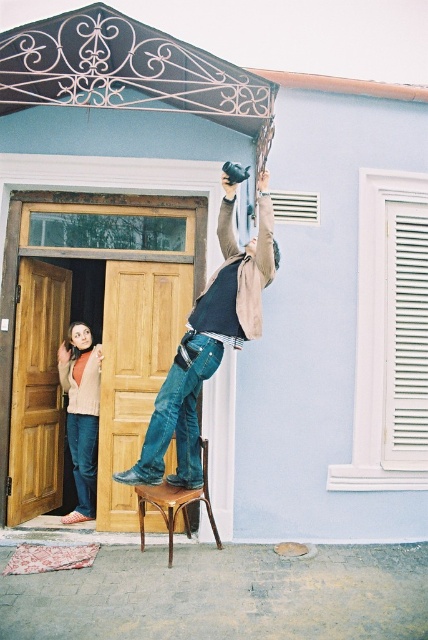
You are a photographer trying to set up a camera on a tripod. You have a denim jeans at left and a brown wooden chair at center in your view. Which object can you use to reach a higher position to adjust the camera?

The denim jeans at left is much taller than the brown wooden chair at center, so you can use the denim jeans at left to reach a higher position to adjust the camera.

You are a delivery person trying to deliver a package to the building with a light blue facade. The recipient is standing at the point marked by the coordinates point (208, 342). Where should you approach to find them?

The point (208, 342) marks denim jeans at center, so you should approach the center area where the denim jeans are located to find the recipient.

You are a delivery person who needs to place a package on the ground near the denim jeans at center. The camera is recording the area. What is the minimum distance you should maintain between the package and the camera to ensure it stays within the camera recording range?

The minimum distance to maintain between the package and the camera should be 4.46 meters, as the denim jeans at center are already 4.46 meters away from the camera. Placing the package closer than that distance would keep it within the camera recording range.